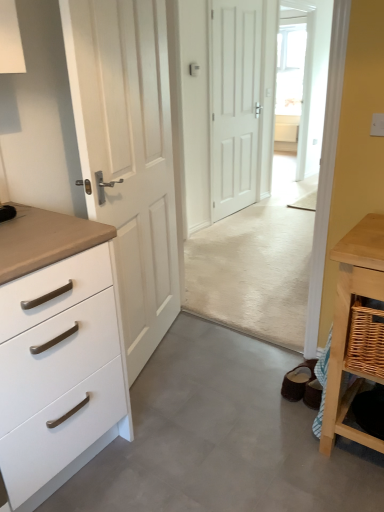
Question: From the image's perspective, is woven wood basket at lower right beneath white matte door at center, the first door positioned from the back?

Choices:
 (A) yes
 (B) no

Answer: (A)

Question: Are woven wood basket at lower right and white matte door at center, the first door positioned from the back, beside each other?

Choices:
 (A) yes
 (B) no

Answer: (B)

Question: From a real-world perspective, is woven wood basket at lower right under white matte door at center, the first door positioned from the back?

Choices:
 (A) yes
 (B) no

Answer: (A)

Question: Considering the relative sizes of woven wood basket at lower right and white matte door at center, marked as the 2th door in a left-to-right arrangement, in the image provided, is woven wood basket at lower right shorter than white matte door at center, marked as the 2th door in a left-to-right arrangement,?

Choices:
 (A) no
 (B) yes

Answer: (B)

Question: Is white matte door at center, positioned as the second door in front-to-back order, located within woven wood basket at lower right?

Choices:
 (A) yes
 (B) no

Answer: (B)

Question: Looking at their shapes, would you say white matte chest of drawers at left is wider or thinner than transparent glass door at upper center?

Choices:
 (A) thin
 (B) wide

Answer: (B)

Question: Considering their positions, is white matte chest of drawers at left located in front of or behind transparent glass door at upper center?

Choices:
 (A) behind
 (B) front

Answer: (B)

Question: From a real-world perspective, is white matte chest of drawers at left above or below transparent glass door at upper center?

Choices:
 (A) below
 (B) above

Answer: (A)

Question: Is white matte chest of drawers at left taller or shorter than transparent glass door at upper center?

Choices:
 (A) tall
 (B) short

Answer: (B)

Question: In terms of height, does woven wood basket at lower right look taller or shorter compared to transparent glass door at upper center?

Choices:
 (A) tall
 (B) short

Answer: (B)

Question: Considering the positions of point (374, 374) and point (297, 143), is point (374, 374) closer or farther from the camera than point (297, 143)?

Choices:
 (A) closer
 (B) farther

Answer: (A)

Question: From the image's perspective, is woven wood basket at lower right above or below transparent glass door at upper center?

Choices:
 (A) below
 (B) above

Answer: (A)

Question: In the image, is woven wood basket at lower right positioned in front of or behind transparent glass door at upper center?

Choices:
 (A) behind
 (B) front

Answer: (B)

Question: Based on their sizes in the image, would you say woven wood table at right is bigger or smaller than transparent glass door at upper center?

Choices:
 (A) big
 (B) small

Answer: (B)

Question: Is woven wood table at right wider or thinner than transparent glass door at upper center?

Choices:
 (A) wide
 (B) thin

Answer: (A)